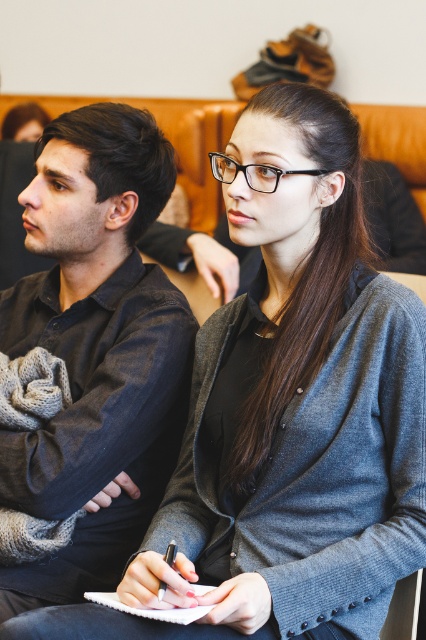
You are a speaker in a lecture hall and you want to hand out materials to the two people sitting at the center. You have a white paper notebook at center and a metallic pen at center. Which item should you give first if you want to give the larger item first?

The white paper notebook at center is bigger than the metallic pen at center, so you should give the white paper notebook at center first.

You are a photographer trying to capture a closeup of the metallic pen at center without including the denim shirt at left in the frame. Based on their positions, is this possible?

The denim shirt at left is positioned on the left side of metallic pen at center, so if you position your camera to the right of the metallic pen at center and frame the shot to exclude the denim shirt at left, it should be possible to capture the closeup without including it.

Based on the photo, you are a photographer positioned at the origin point of the coordinate system in the image. The white paper notebook at center is at coordinates 0.952, 0.352. If you want to take a photo that includes both the man on the left and the woman on the right, will the notebook block your view of either of them?

The white paper notebook at center is located at point (149, 609). Since the notebook is at the center, it might block the view of the woman on the right who is holding it, but the man on the left should still be visible. However, without knowing the exact positions of the individuals and the camera angle, it is difficult to determine precisely. But based on the given coordinates, the notebook is centrally placed and may obstruct part of the woman holding it.